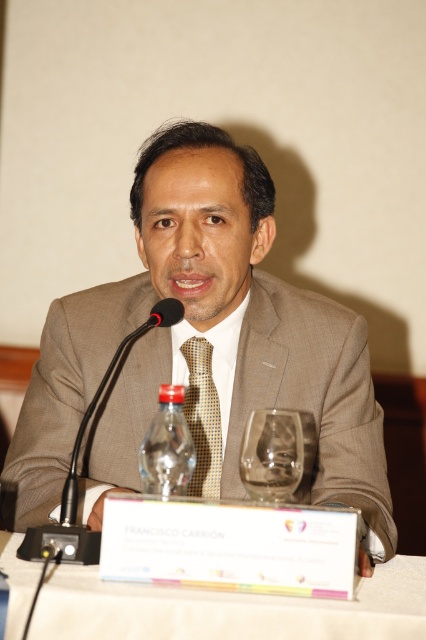
Does brown checkered tie at center have a lesser height compared to black matte microphone at left?

No, brown checkered tie at center is not shorter than black matte microphone at left.

Is brown checkered tie at center thinner than black matte microphone at left?

No, brown checkered tie at center is not thinner than black matte microphone at left.

Where is `brown checkered tie at center`? This screenshot has width=426, height=640. brown checkered tie at center is located at coordinates (203, 417).

Can you confirm if brown textured suit at center is positioned below clear plastic bottle at center?

Incorrect, brown textured suit at center is not positioned below clear plastic bottle at center.

The width and height of the screenshot is (426, 640). Describe the element at coordinates (207, 339) in the screenshot. I see `brown textured suit at center` at that location.

This screenshot has height=640, width=426. In order to click on brown textured suit at center in this screenshot , I will do `click(207, 339)`.

Between point (235, 237) and point (276, 484), which one is positioned behind?

Point (235, 237)

The height and width of the screenshot is (640, 426). In order to click on brown textured suit at center in this screenshot , I will do `click(207, 339)`.